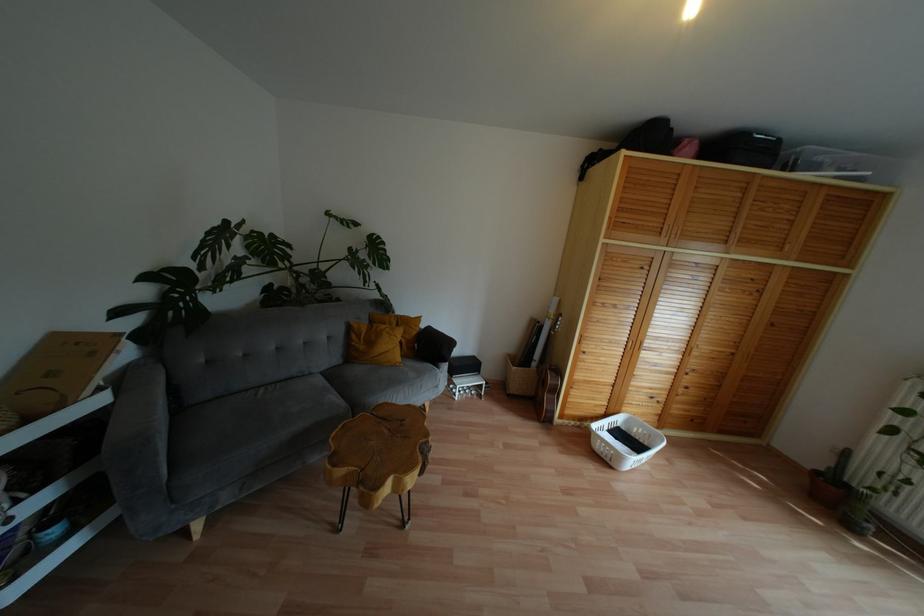
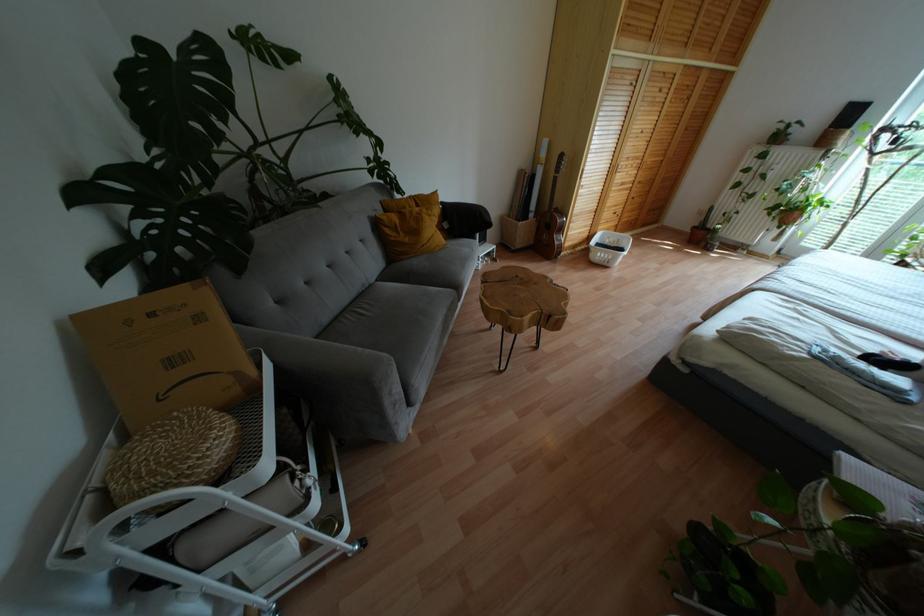
Question: I am providing you with two images of the same scene from different viewpoints. Please identify which objects are invisible in image2.

Choices:
 (A) yellow cushion
 (B) white laundry basket
 (C) sofa sitting surface
 (D) none of these

Answer: (D)